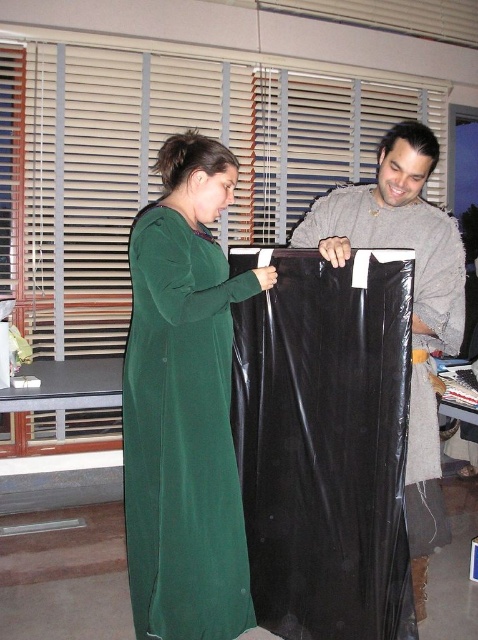
Based on the photo, you are a delivery person who just arrived at the scene. You need to place a new package on the floor between the black plastic bag at center and the green velvet dress at center. Based on their positions, which object should you place the package closer to if you want it to be to the left of both objects?

You should place the package closer to the green velvet dress at center because the black plastic bag at center is to the right of the green velvet dress at center, so placing it near the leftmost object would position it to the left of both.

You are moving a large item and need to determine if it can fit through a doorway. You have a black plastic bag at center and a green velvet dress at center. Which object is bigger and would require more space to move?

The black plastic bag at center is larger in size than the green velvet dress at center, so the black plastic bag at center would require more space to move.